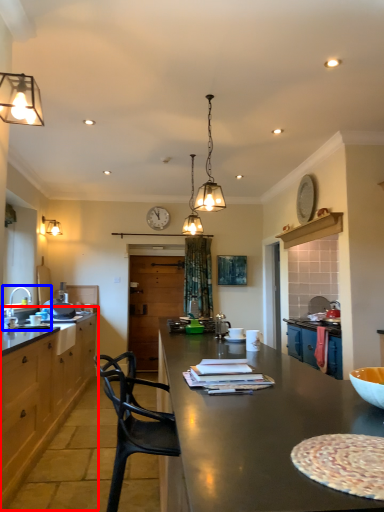
Question: Which object is closer to the camera taking this photo, cabinetry (highlighted by a red box) or sink (highlighted by a blue box)?

Choices:
 (A) cabinetry
 (B) sink

Answer: (A)